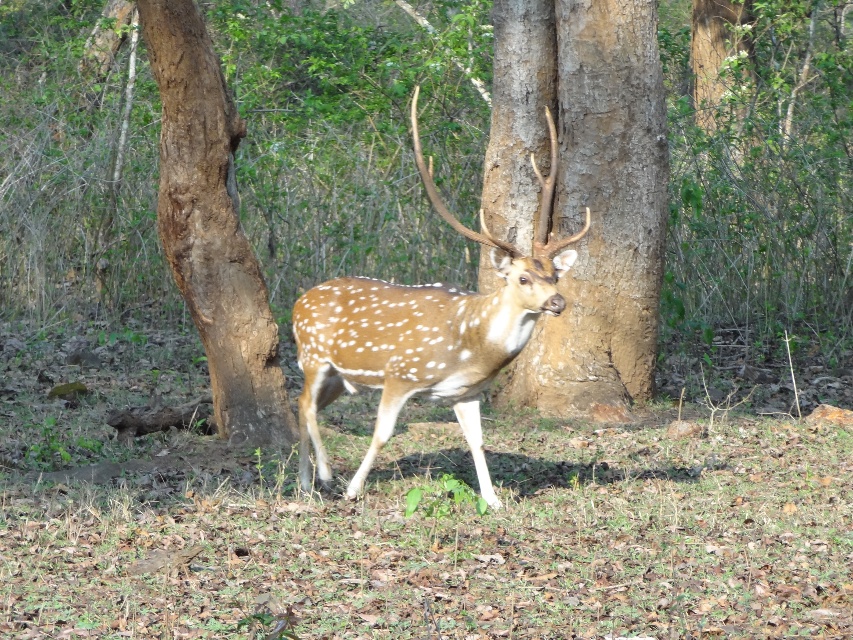
Question: Which point is closer to the camera?

Choices:
 (A) brown rough bark at left
 (B) brown rough tree trunk at center

Answer: (A)

Question: Considering the real-world distances, which object is closest to the spotted fur deer at center?

Choices:
 (A) brown rough tree trunk at center
 (B) brown rough bark at left

Answer: (B)

Question: Which object appears closest to the camera in this image?

Choices:
 (A) brown rough tree trunk at center
 (B) spotted fur deer at center
 (C) brown rough bark at left

Answer: (B)

Question: Is brown rough tree trunk at center to the left of brown rough bark at left from the viewer's perspective?

Choices:
 (A) no
 (B) yes

Answer: (A)

Question: Is brown rough tree trunk at center wider than brown rough bark at left?

Choices:
 (A) yes
 (B) no

Answer: (A)

Question: Is spotted fur deer at center to the left of brown rough bark at left from the viewer's perspective?

Choices:
 (A) no
 (B) yes

Answer: (A)